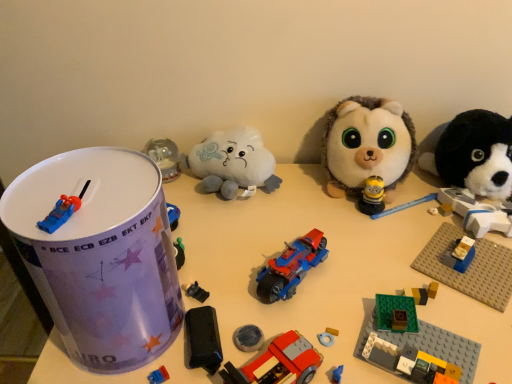
Find the location of a particular element. spots to the right of black plastic toy car at center, which is the 6th toy in right-to-left order is located at coordinates (306, 291).